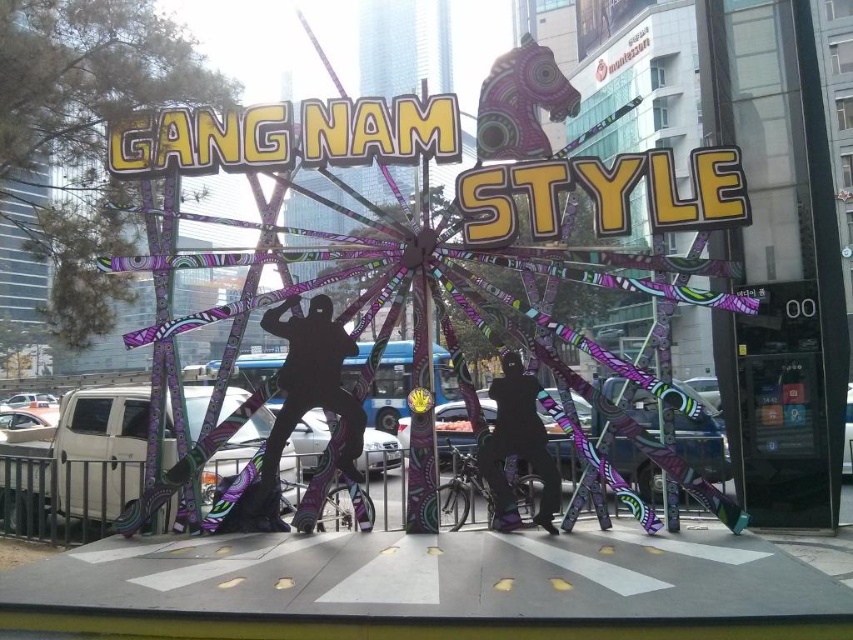
Which is in front, point (624, 204) or point (334, 355)?

Point (624, 204) is more forward.

Can you confirm if metallic purple ferris wheel at center is bigger than black matte silhouette at center?

Yes.

Is point (722, 504) positioned after point (296, 390)?

No, (722, 504) is closer to viewer.

Image resolution: width=853 pixels, height=640 pixels. Find the location of `metallic purple ferris wheel at center`. metallic purple ferris wheel at center is located at coordinates (532, 237).

Is metallic purple ferris wheel at center shorter than black matte pants at center?

Incorrect, metallic purple ferris wheel at center's height does not fall short of black matte pants at center's.

Is metallic purple ferris wheel at center closer to camera compared to black matte pants at center?

Yes, it is in front of black matte pants at center.

Is point (233, 253) closer to viewer compared to point (538, 461)?

That is False.

Where is `metallic purple ferris wheel at center`? metallic purple ferris wheel at center is located at coordinates (532, 237).

Is black matte silhouette at center positioned in front of black matte pants at center?

No, it is not.

Which is more to the right, black matte silhouette at center or black matte pants at center?

Positioned to the right is black matte pants at center.

Which is in front, point (270, 515) or point (525, 440)?

Point (525, 440)

At what (x,y) coordinates should I click in order to perform the action: click on black matte silhouette at center. Please return your answer as a coordinate pair (x, y). This screenshot has width=853, height=640. Looking at the image, I should click on (308, 392).